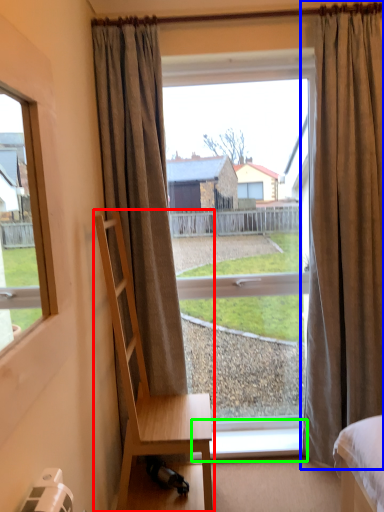
Question: Estimate the real-world distances between objects in this image. Which object is closer to chair (highlighted by a red box), curtain (highlighted by a blue box) or window sill (highlighted by a green box)?

Choices:
 (A) curtain
 (B) window sill

Answer: (B)